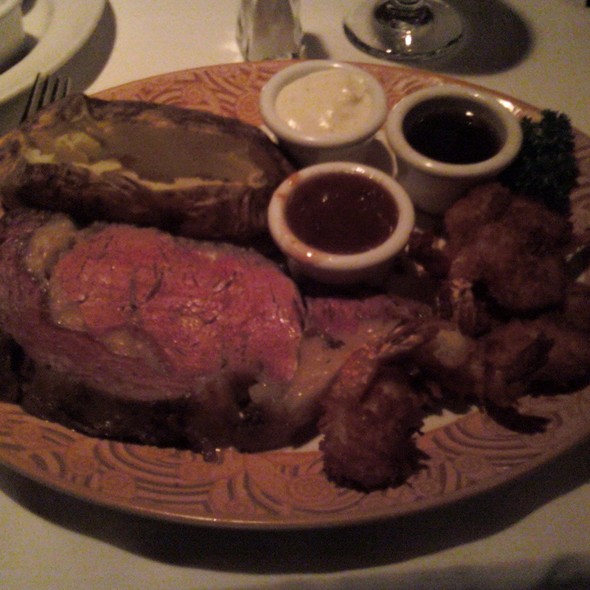
The image size is (590, 590). What are the coordinates of `wine glass` in the screenshot? It's located at (404, 37).